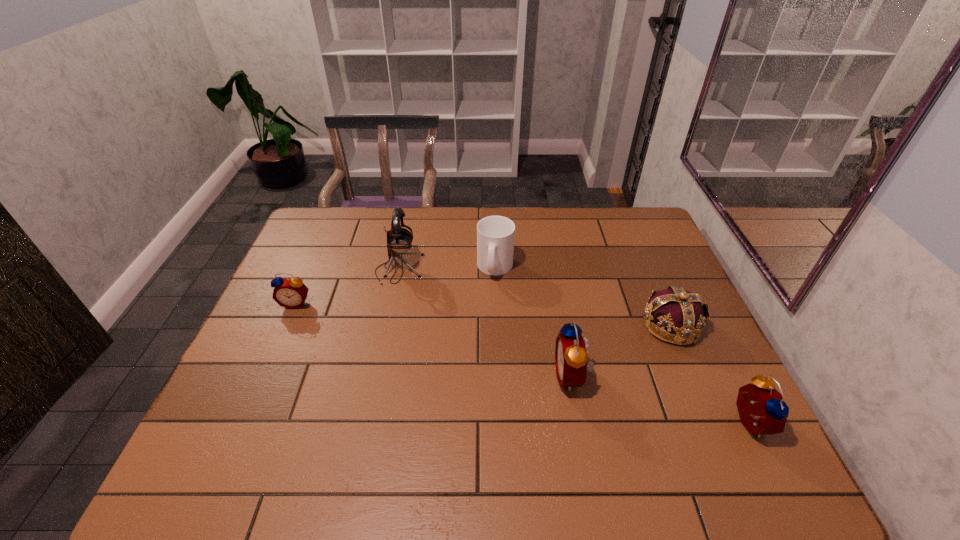
At what (x,y) coordinates should I click in order to perform the action: click on vacant space in between the mug and the rightmost alarm clock. Please return your answer as a coordinate pair (x, y). This screenshot has width=960, height=540. Looking at the image, I should click on (621, 345).

You are a GUI agent. You are given a task and a screenshot of the screen. Output one action in this format:
    pyautogui.click(x=<x>, y=<y>)
    Task: Click on the free space between the tallest object and the crown
    
    Given the screenshot: What is the action you would take?
    pyautogui.click(x=535, y=297)

Locate an element on the screen. This screenshot has width=960, height=540. vacant space that is in between the shortest alarm clock and the crown is located at coordinates (484, 314).

Where is `free area in between the crown and the nearest alarm clock`? The image size is (960, 540). free area in between the crown and the nearest alarm clock is located at coordinates [x=708, y=374].

Find the location of a particular element. Image resolution: width=960 pixels, height=540 pixels. vacant space in between the crown and the mug is located at coordinates (583, 296).

The image size is (960, 540). Identify the location of free space that is in between the farthest alarm clock and the tallest object. (348, 286).

Identify the location of free space between the mug and the leftmost object. (396, 286).

Select which object appears as the closest to the crown. Please provide its 2D coordinates. Your answer should be formatted as a tuple, i.e. [(x, y)], where the tuple contains the x and y coordinates of a point satisfying the conditions above.

[(762, 411)]

Point out which object is positioned as the second nearest to the mug. Please provide its 2D coordinates. Your answer should be formatted as a tuple, i.e. [(x, y)], where the tuple contains the x and y coordinates of a point satisfying the conditions above.

[(571, 356)]

Choose which alarm clock is the nearest neighbor to the crown. Please provide its 2D coordinates. Your answer should be formatted as a tuple, i.e. [(x, y)], where the tuple contains the x and y coordinates of a point satisfying the conditions above.

[(762, 411)]